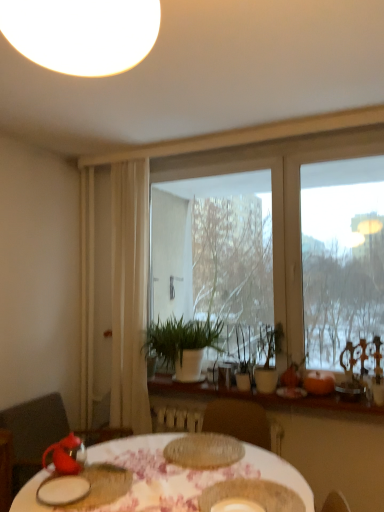
I want to click on vacant area on top of matte ceramic vase at lower right, the eighth tableware from the left (from a real-world perspective), so click(x=294, y=387).